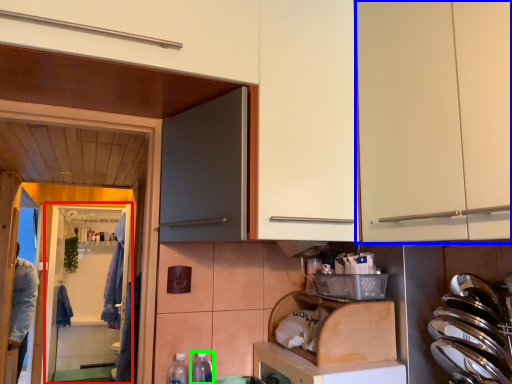
Question: Which object is the closest to the screen door (highlighted by a red box)? Choose among these: cabinetry (highlighted by a blue box) or bottle (highlighted by a green box).

Choices:
 (A) cabinetry
 (B) bottle

Answer: (B)